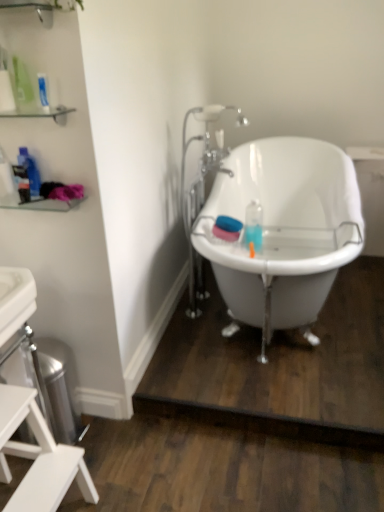
At what (x,y) coordinates should I click in order to perform the action: click on chrome metallic faucet at center. Please return your answer as a coordinate pair (x, y). Looking at the image, I should click on (202, 188).

The width and height of the screenshot is (384, 512). What do you see at coordinates (38, 457) in the screenshot?
I see `white matte stool at lower left` at bounding box center [38, 457].

Identify the location of blue matte mouthwash at center. The image size is (384, 512). (227, 228).

How different are the orientations of translucent plastic bottle at left, placed as the second bottle when sorted from right to left, and chrome metallic faucet at center in degrees?

91.1 degrees separate the facing orientations of translucent plastic bottle at left, placed as the second bottle when sorted from right to left, and chrome metallic faucet at center.

From a real-world perspective, is translucent plastic bottle at left, placed as the second bottle when sorted from right to left, physically below chrome metallic faucet at center?

No.

Considering the positions of objects translucent plastic bottle at left, placed as the second bottle when sorted from right to left, and chrome metallic faucet at center in the image provided, who is behind, translucent plastic bottle at left, placed as the second bottle when sorted from right to left, or chrome metallic faucet at center?

Positioned behind is chrome metallic faucet at center.

Who is taller, translucent plastic bottle at left, which appears as the 1th bottle when viewed from the left, or chrome metallic faucet at center?

chrome metallic faucet at center is taller.

Which is in front, point (49, 499) or point (38, 113)?

Positioned in front is point (49, 499).

Would you say white matte stool at lower left is inside or outside clear glass shelf at upper left?

The correct answer is: outside.

Is white matte stool at lower left in front of or behind clear glass shelf at upper left in the image?

white matte stool at lower left is positioned farther from the viewer than clear glass shelf at upper left.

Locate an element on the screen. The height and width of the screenshot is (512, 384). shelf that is above the white matte stool at lower left (from a real-world perspective) is located at coordinates (x=35, y=9).

Which is farther, (1, 396) or (24, 164)?

The point (24, 164) is behind.

Between white matte stool at lower left and translucent plastic bottle at upper left, marked as the 2th bottle in a left-to-right arrangement, which one has larger width?

white matte stool at lower left.

Is white matte stool at lower left in front of or behind translucent plastic bottle at upper left, marked as the 2th bottle in a left-to-right arrangement, in the image?

Clearly, white matte stool at lower left is in front of translucent plastic bottle at upper left, marked as the 2th bottle in a left-to-right arrangement.

From the image's perspective, is white matte stool at lower left above translucent plastic bottle at upper left, marked as the 2th bottle in a left-to-right arrangement?

No, from the image's perspective, white matte stool at lower left is not over translucent plastic bottle at upper left, marked as the 2th bottle in a left-to-right arrangement.

Between chrome metallic faucet at center and translucent plastic bottle at upper left, the first bottle viewed from the right, which one is positioned in front?

translucent plastic bottle at upper left, the first bottle viewed from the right, is in front.

From a real-world perspective, is chrome metallic faucet at center under translucent plastic bottle at upper left, the first bottle viewed from the right?

Indeed, from a real-world perspective, chrome metallic faucet at center is positioned beneath translucent plastic bottle at upper left, the first bottle viewed from the right.

Can you confirm if chrome metallic faucet at center is positioned to the right of translucent plastic bottle at upper left, marked as the 2th bottle in a left-to-right arrangement?

Correct, you'll find chrome metallic faucet at center to the right of translucent plastic bottle at upper left, marked as the 2th bottle in a left-to-right arrangement.

Visually, is blue matte mouthwash at center positioned to the left or to the right of white matte stool at lower left?

In the image, blue matte mouthwash at center appears on the right side of white matte stool at lower left.

From the picture: Is blue matte mouthwash at center spatially inside white matte stool at lower left, or outside of it?

blue matte mouthwash at center lies outside white matte stool at lower left.

Find the location of a particular element. The height and width of the screenshot is (512, 384). mouthwash that appears on the right of white matte stool at lower left is located at coordinates (227, 228).

Is clear glass shelf at upper left not close to white matte stool at lower left?

That's right, there is a large distance between clear glass shelf at upper left and white matte stool at lower left.

Consider the image. From a real-world perspective, who is located lower, clear glass shelf at upper left or white matte stool at lower left?

white matte stool at lower left, from a real-world perspective.

From the image's perspective, is clear glass shelf at upper left located above or below white matte stool at lower left?

clear glass shelf at upper left is situated higher than white matte stool at lower left in the image.

Considering the positions of objects clear glass shelf at upper left and white matte stool at lower left in the image provided, who is more to the right, clear glass shelf at upper left or white matte stool at lower left?

clear glass shelf at upper left is more to the right.

From the image's perspective, between translucent plastic bottle at left, which appears as the 1th bottle when viewed from the left, and blue matte mouthwash at center, which one is located above?

translucent plastic bottle at left, which appears as the 1th bottle when viewed from the left, appears higher in the image.

Does translucent plastic bottle at left, placed as the second bottle when sorted from right to left, lie behind blue matte mouthwash at center?

No, the depth of translucent plastic bottle at left, placed as the second bottle when sorted from right to left, is less than that of blue matte mouthwash at center.

Does translucent plastic bottle at left, placed as the second bottle when sorted from right to left, appear on the left side of blue matte mouthwash at center?

Indeed, translucent plastic bottle at left, placed as the second bottle when sorted from right to left, is positioned on the left side of blue matte mouthwash at center.

Which is correct: translucent plastic bottle at left, placed as the second bottle when sorted from right to left, is inside blue matte mouthwash at center, or outside of it?

translucent plastic bottle at left, placed as the second bottle when sorted from right to left, exists outside the volume of blue matte mouthwash at center.

The width and height of the screenshot is (384, 512). There is a chrome metallic faucet at center. What are the coordinates of `the 1st bottle above it (from the image's perspective)` in the screenshot? It's located at (6, 176).

This screenshot has height=512, width=384. In the image, there is a clear glass shelf at upper left. Identify the location of furniture below it (from the image's perspective). (38, 457).

Considering their positions, is chrome metallic faucet at center positioned further to white glossy bathtub at center than translucent plastic bottle at left, placed as the second bottle when sorted from right to left?

Based on the image, translucent plastic bottle at left, placed as the second bottle when sorted from right to left, appears to be further to white glossy bathtub at center.

Which object lies nearer to the anchor point translucent plastic bottle at left, placed as the second bottle when sorted from right to left, translucent plastic bottle at upper left, the first bottle viewed from the right, or white glossy bathtub at center?

Among the two, translucent plastic bottle at upper left, the first bottle viewed from the right, is located nearer to translucent plastic bottle at left, placed as the second bottle when sorted from right to left.

Estimate the real-world distances between objects in this image. Which object is closer to chrome metallic faucet at center, translucent plastic bottle at left, which appears as the 1th bottle when viewed from the left, or clear glass shelf at upper left?

clear glass shelf at upper left is closer to chrome metallic faucet at center.

When comparing their distances from chrome metallic faucet at center, does translucent plastic bottle at left, placed as the second bottle when sorted from right to left, or white glossy bathtub at center seem closer?

The object closer to chrome metallic faucet at center is white glossy bathtub at center.

From the image, which object appears to be farther from white glossy bathtub at center, translucent plastic bottle at upper left, marked as the 2th bottle in a left-to-right arrangement, or blue matte mouthwash at center?

The object further to white glossy bathtub at center is translucent plastic bottle at upper left, marked as the 2th bottle in a left-to-right arrangement.

Based on their spatial positions, is white glossy bathtub at center or clear glass shelf at upper left closer to blue matte mouthwash at center?

Among the two, white glossy bathtub at center is located nearer to blue matte mouthwash at center.

Based on the photo, estimate the real-world distances between objects in this image. Which object is further from clear glass shelf at upper left, blue matte mouthwash at center or translucent plastic bottle at left, which appears as the 1th bottle when viewed from the left?

blue matte mouthwash at center is positioned further to the anchor clear glass shelf at upper left.

When comparing their distances from white matte stool at lower left, does blue matte mouthwash at center or white glossy bathtub at center seem closer?

blue matte mouthwash at center lies closer to white matte stool at lower left than the other object.

The image size is (384, 512). I want to click on faucet between clear glass shelf at upper left and white matte stool at lower left vertically, so click(x=202, y=188).

The height and width of the screenshot is (512, 384). I want to click on bathtub positioned between clear glass shelf at upper left and blue matte mouthwash at center from near to far, so click(x=283, y=230).

Image resolution: width=384 pixels, height=512 pixels. In order to click on faucet located between translucent plastic bottle at upper left, marked as the 2th bottle in a left-to-right arrangement, and blue matte mouthwash at center in the left-right direction in this screenshot , I will do `click(202, 188)`.

You are a GUI agent. You are given a task and a screenshot of the screen. Output one action in this format:
    pyautogui.click(x=<x>, y=<y>)
    Task: Click on the faucet between translucent plastic bottle at upper left, marked as the 2th bottle in a left-to-right arrangement, and white glossy bathtub at center, in the horizontal direction
    This screenshot has height=512, width=384.
    Given the screenshot: What is the action you would take?
    pyautogui.click(x=202, y=188)